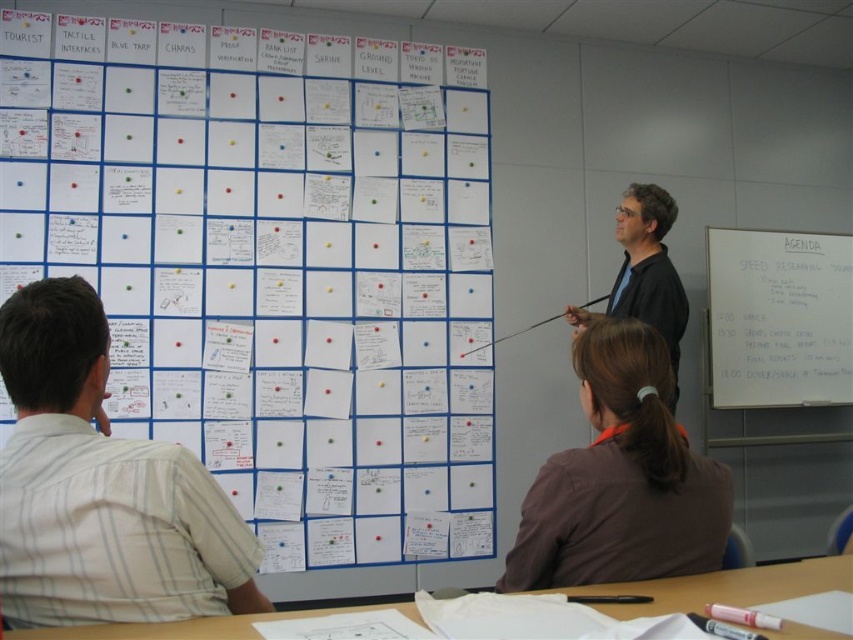
Question: Is whiteboard at right wider than black matte shirt at center?

Choices:
 (A) no
 (B) yes

Answer: (B)

Question: Which point appears farthest from the camera in this image?

Choices:
 (A) (675, 321)
 (B) (677, 500)
 (C) (193, 529)

Answer: (A)

Question: Which object is positioned closest to the whiteboard at right?

Choices:
 (A) brown fabric shirt at center
 (B) white paper at upper left
 (C) black matte shirt at center

Answer: (C)

Question: Which point is farther to the camera?

Choices:
 (A) (663, 260)
 (B) (712, 317)
 (C) (157, 452)
 (D) (596, 481)

Answer: (B)

Question: Can you confirm if whiteboard at right is bigger than black matte shirt at center?

Choices:
 (A) no
 (B) yes

Answer: (B)

Question: Is the position of white paper at upper left more distant than that of brown fabric shirt at center?

Choices:
 (A) no
 (B) yes

Answer: (B)